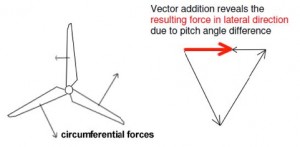
This screenshot has width=300, height=147. I want to click on hub of a fan, so click(x=69, y=91).